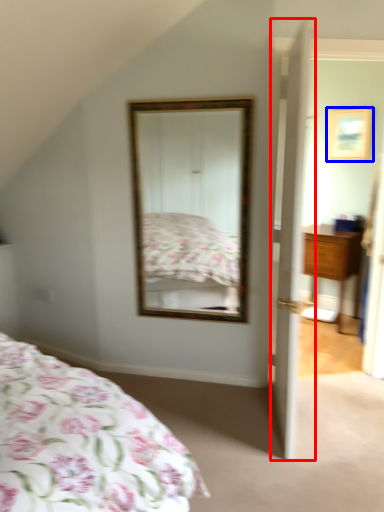
Question: Which point is closer to the camera, door (highlighted by a red box) or picture frame (highlighted by a blue box)?

Choices:
 (A) door
 (B) picture frame

Answer: (A)